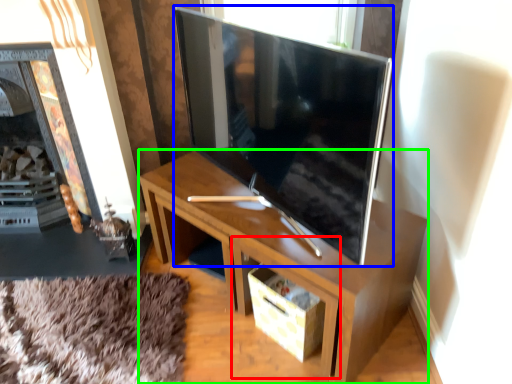
Question: Which is nearer to the drawer (highlighted by a red box)? television (highlighted by a blue box) or desk (highlighted by a green box).

Choices:
 (A) television
 (B) desk

Answer: (B)